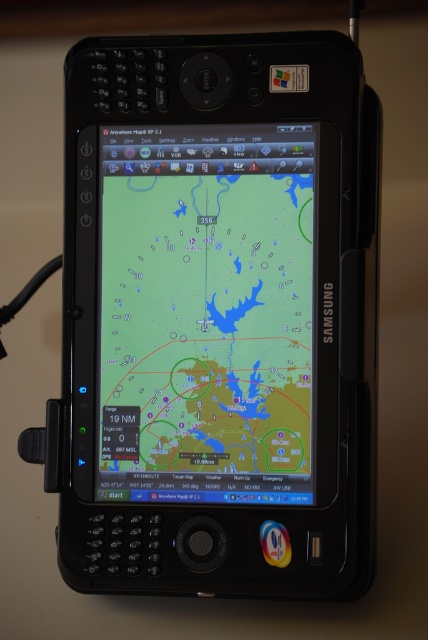
Question: Which of the following is the closest to the observer?

Choices:
 (A) [x=202, y=476]
 (B) [x=154, y=339]

Answer: (A)

Question: Does black plastic smartphone at center appear under matte screen map at center?

Choices:
 (A) no
 (B) yes

Answer: (A)

Question: Which of the following is the closest to the observer?

Choices:
 (A) (237, 225)
 (B) (234, 365)

Answer: (B)

Question: Does black plastic smartphone at center have a greater width compared to matte screen map at center?

Choices:
 (A) yes
 (B) no

Answer: (A)

Question: Can you confirm if black plastic smartphone at center is wider than matte screen map at center?

Choices:
 (A) yes
 (B) no

Answer: (A)